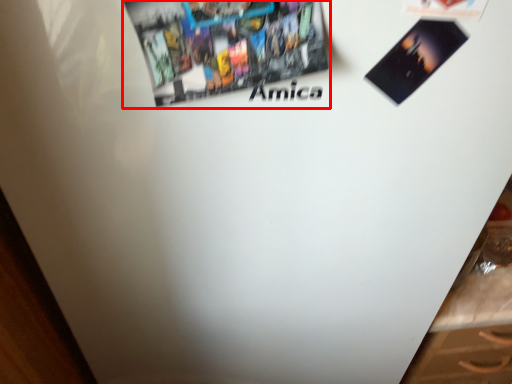
Question: From the image's perspective, considering the relative positions of poster (annotated by the red box) and flyer in the image provided, where is poster (annotated by the red box) located with respect to the staircase?

Choices:
 (A) above
 (B) below

Answer: (B)